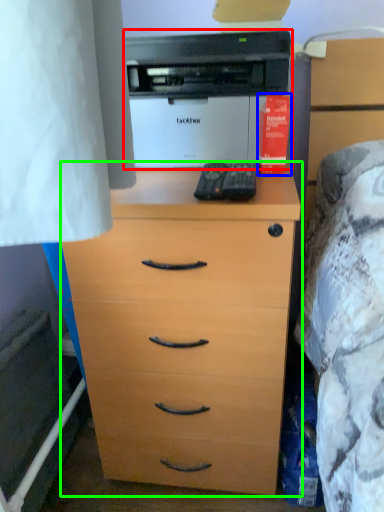
Question: Which object is positioned farthest from printer (highlighted by a red box)? Select from book (highlighted by a blue box) and chest of drawers (highlighted by a green box).

Choices:
 (A) book
 (B) chest of drawers

Answer: (B)